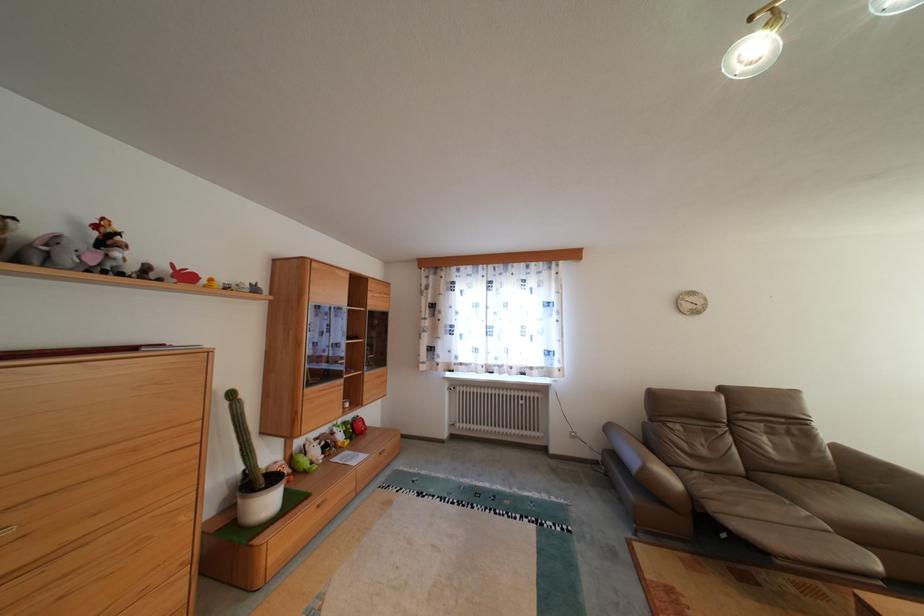
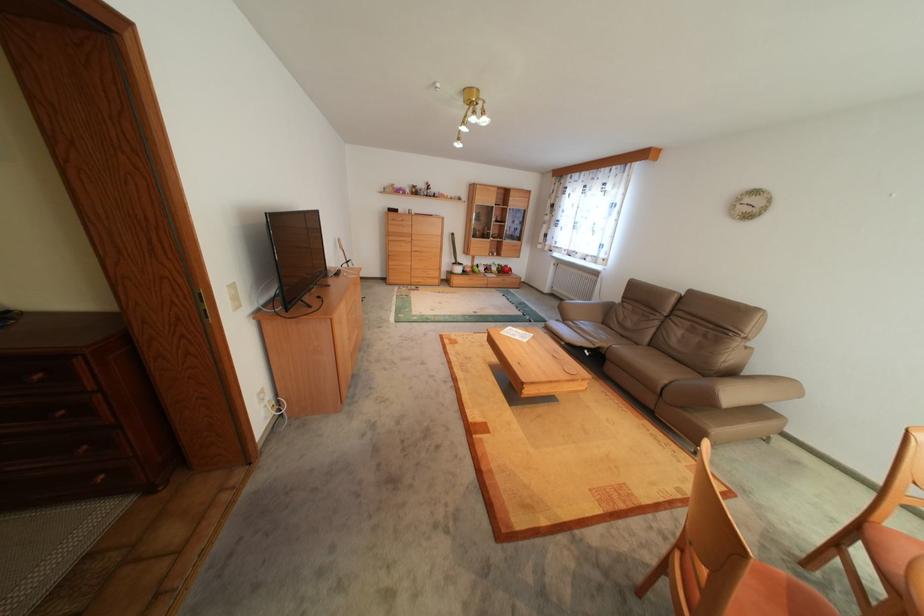
The point at (x=800, y=432) is marked in the first image. Where is the corresponding point in the second image?

(715, 334)